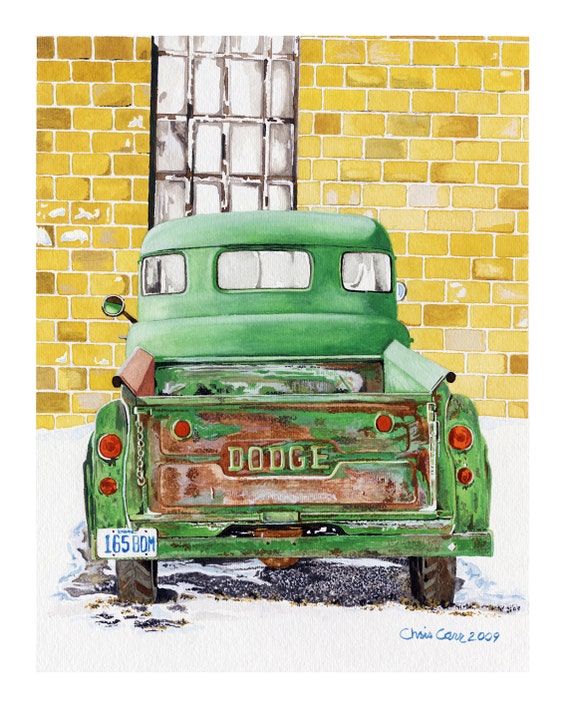
The height and width of the screenshot is (710, 570). In order to click on right mirror in this screenshot , I will do `click(402, 288)`.